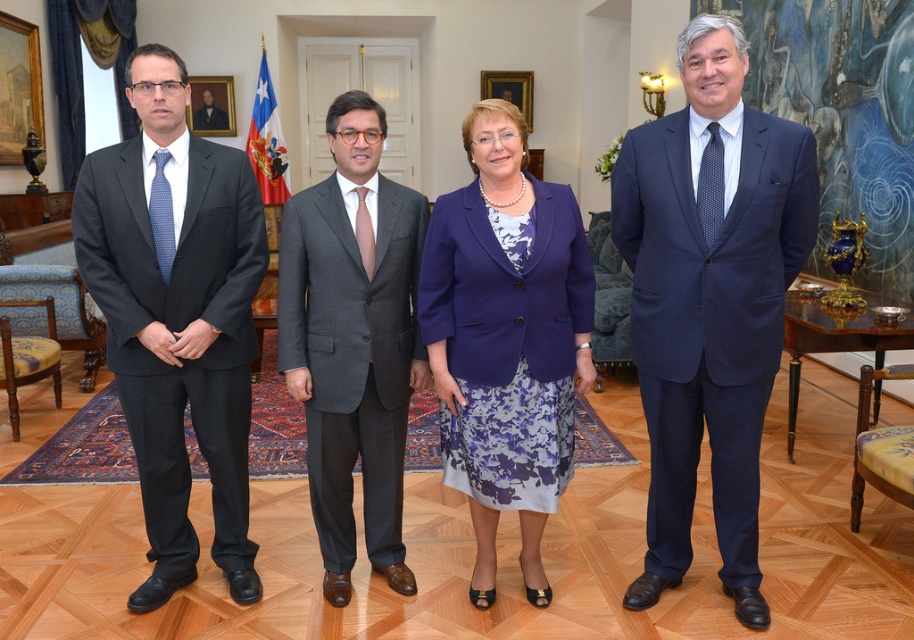
Does matte black suit at left appear over gray wool suit at center?

Yes.

Is matte black suit at left further to the viewer compared to gray wool suit at center?

No, it is in front of gray wool suit at center.

Who is more forward, (246, 528) or (381, 136)?

Point (381, 136)

Where is `matte black suit at left`? The image size is (914, 640). matte black suit at left is located at coordinates (177, 316).

Image resolution: width=914 pixels, height=640 pixels. I want to click on navy blue suit at right, so click(x=709, y=298).

Does point (629, 212) come in front of point (103, 230)?

No, (629, 212) is behind (103, 230).

This screenshot has width=914, height=640. What are the coordinates of `navy blue suit at right` in the screenshot? It's located at (709, 298).

Is the position of matte blue blazer at center less distant than that of gray wool suit at center?

Yes, matte blue blazer at center is closer to the viewer.

Is matte blue blazer at center wider than gray wool suit at center?

Yes, matte blue blazer at center is wider than gray wool suit at center.

Is point (574, 230) farther from viewer compared to point (356, 404)?

No, (574, 230) is closer to viewer.

At what (x,y) coordinates should I click in order to perform the action: click on matte blue blazer at center. Please return your answer as a coordinate pair (x, y). This screenshot has width=914, height=640. Looking at the image, I should click on (506, 339).